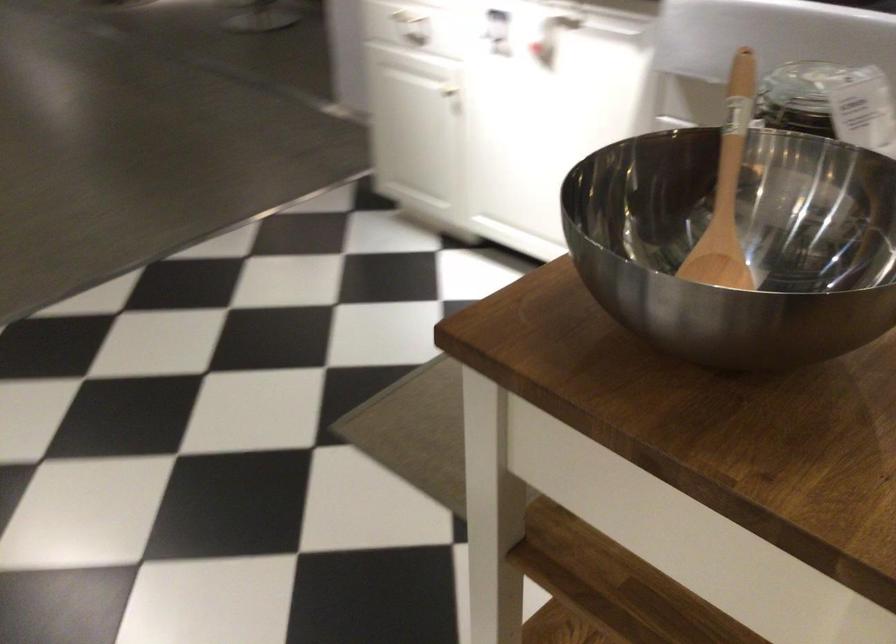
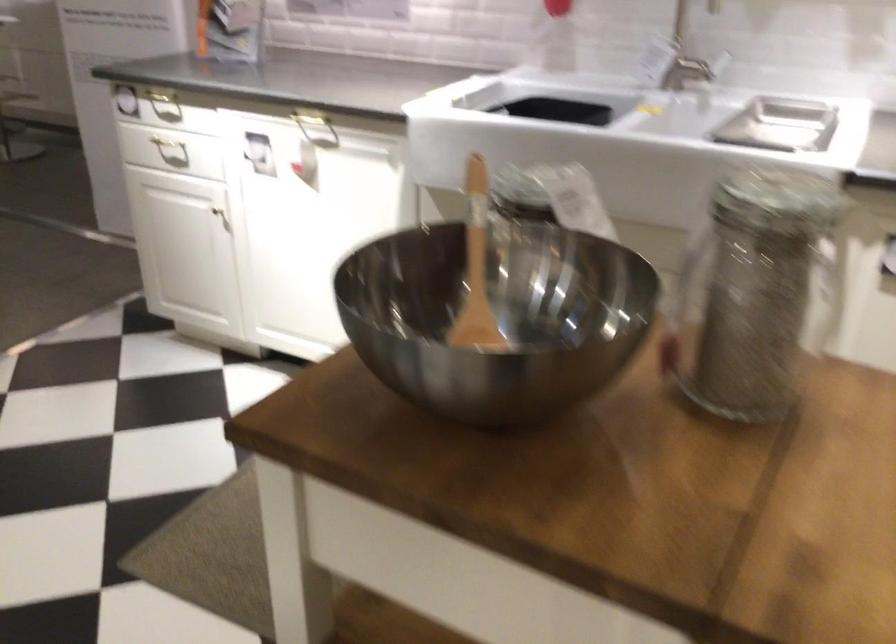
Question: What movement of the cameraman would produce the second image?

Choices:
 (A) Left
 (B) Right
 (C) Forward
 (D) Backward

Answer: (D)